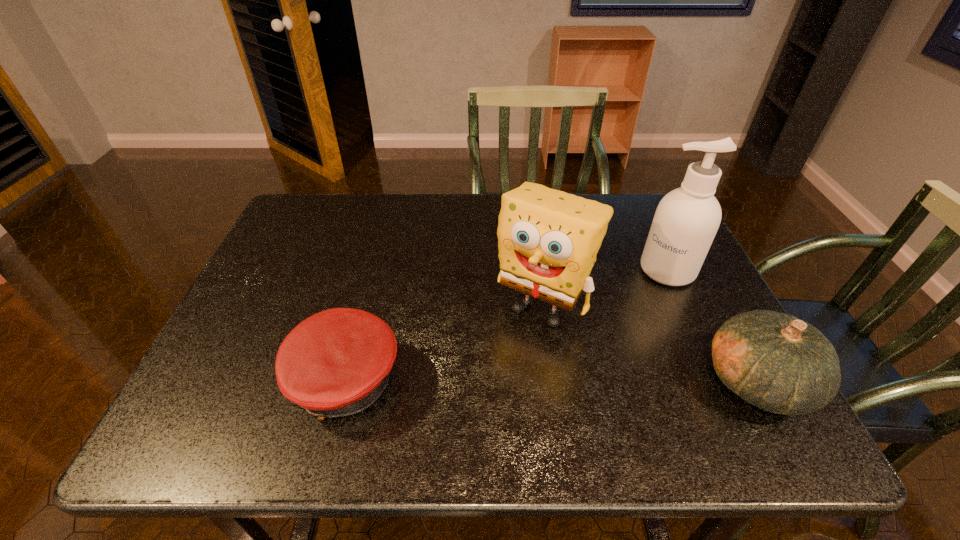
Image resolution: width=960 pixels, height=540 pixels. What are the coordinates of `free space on the desktop that is between the cap and the gourd and is positioned on the front label of the cleansing agent` in the screenshot? It's located at (556, 382).

Identify the location of free space on the desktop that is between the cap and the gourd and is positioned on the face of the third shortest object. The image size is (960, 540). (492, 382).